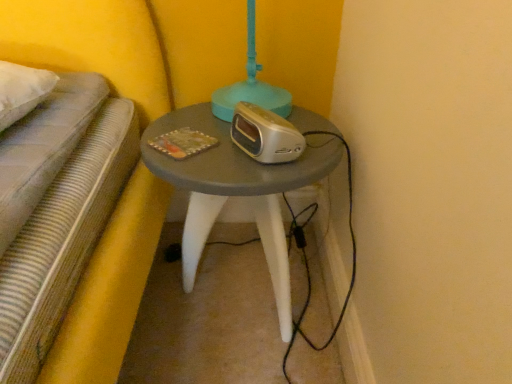
I want to click on vacant area that is situated to the right of silver metallic alarm clock at center, so click(318, 141).